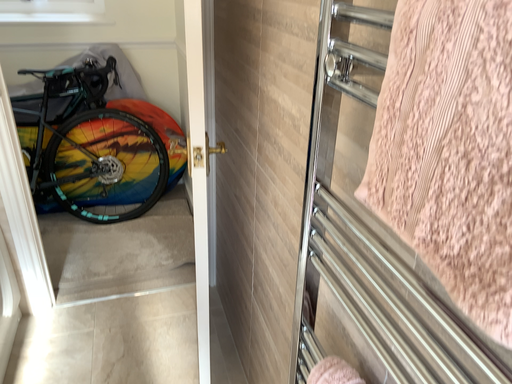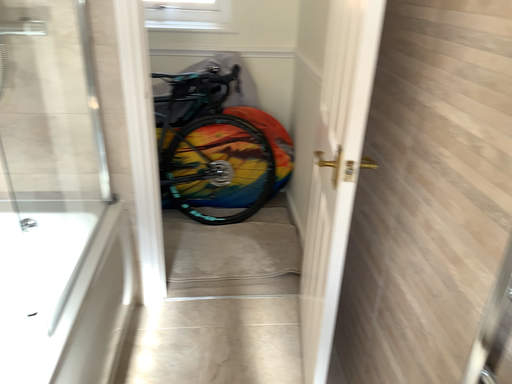
Question: Which way did the camera rotate in the video?

Choices:
 (A) rotated left
 (B) rotated right

Answer: (A)